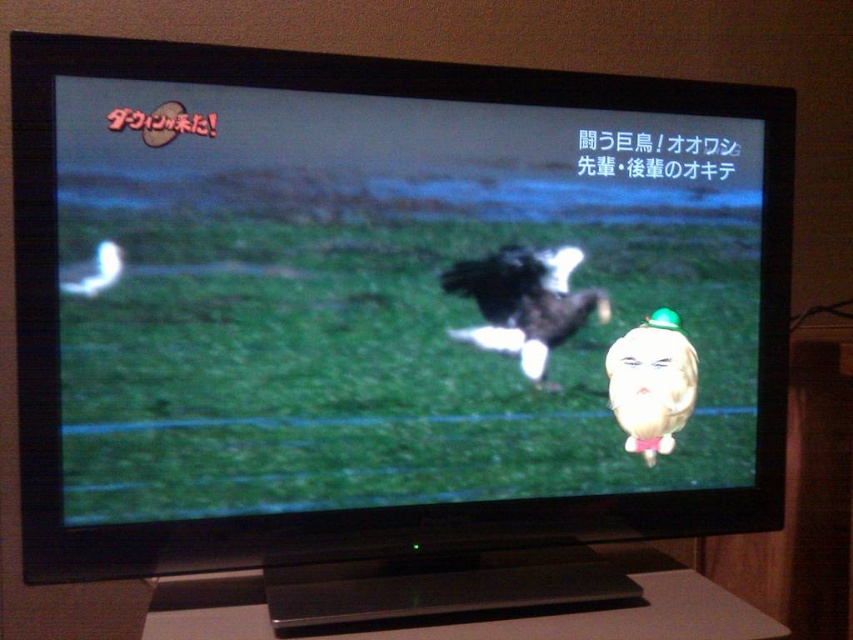
Does point (483, 346) come closer to viewer compared to point (641, 444)?

Yes, point (483, 346) is closer to viewer.

Is point (537, 337) closer to camera compared to point (630, 342)?

Yes.

Locate an element on the screen. The height and width of the screenshot is (640, 853). black glossy eagle at center is located at coordinates (524, 301).

Based on the photo, measure the distance between point (64, 241) and camera.

Point (64, 241) and camera are 99.59 centimeters apart from each other.

Is black matte eagle at center positioned in front of matte yellow duck at center?

Yes, it is.

Who is more distant from viewer, (726,317) or (631,349)?

Point (726,317)

The image size is (853, 640). What are the coordinates of `black matte eagle at center` in the screenshot? It's located at (383, 298).

Is point (554, 632) positioned before point (614, 362)?

Yes.

Where is `black plastic flat at lower center`? The width and height of the screenshot is (853, 640). black plastic flat at lower center is located at coordinates (602, 618).

Is point (608, 625) closer to camera compared to point (645, 460)?

Yes, point (608, 625) is in front of point (645, 460).

Find the location of a particular element. black plastic flat at lower center is located at coordinates (602, 618).